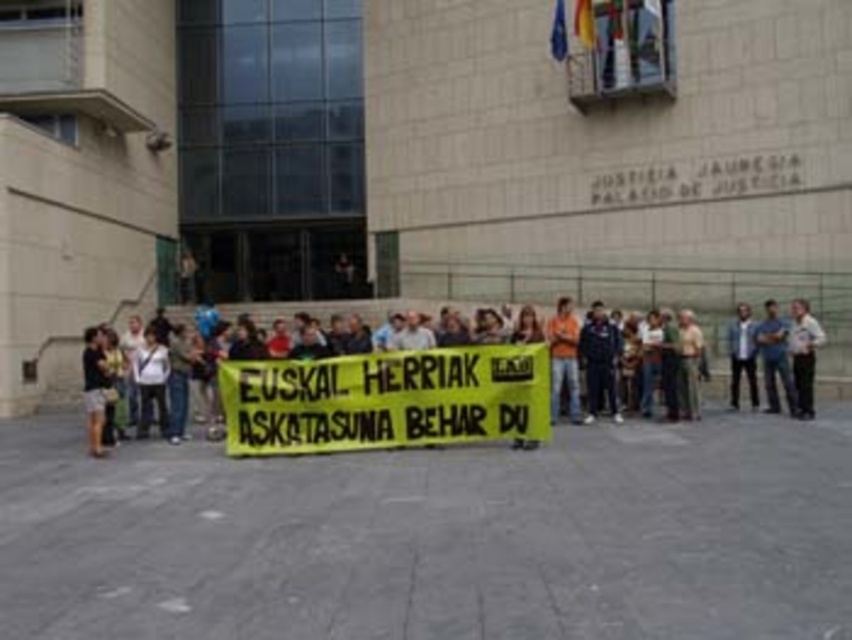
You are a photographer standing at the center of the scene. You want to take a photo of the yellow fabric banner at center. Based on its 2D location, where should you aim your camera?

The yellow fabric banner at center is located at the 2D coordinates point (x=367, y=380), so you should aim your camera at that point to capture it.

You are a photographer standing at the edge of the protest. You want to take a photo that includes both the yellow fabric banner at center and the light brown leather jacket at center. Given that your camera has a maximum focus range of 6 meters, will you be able to capture both subjects in focus without moving your position?

The distance between the yellow fabric banner at center and the light brown leather jacket at center is 6.67 meters. Since the camera can only focus up to 6 meters, the subjects are beyond the focus range. Therefore, you cannot capture both in focus without moving.